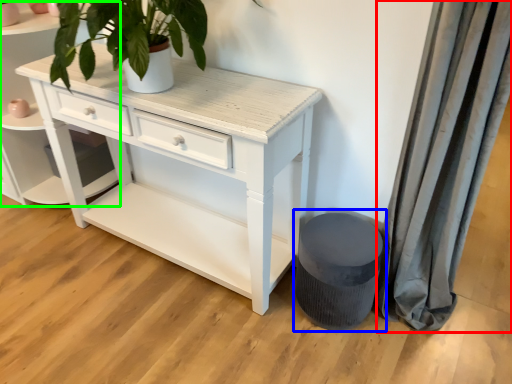
Question: Estimate the real-world distances between objects in this image. Which object is farther from curtain (highlighted by a red box), music stool (highlighted by a blue box) or shelf (highlighted by a green box)?

Choices:
 (A) music stool
 (B) shelf

Answer: (B)